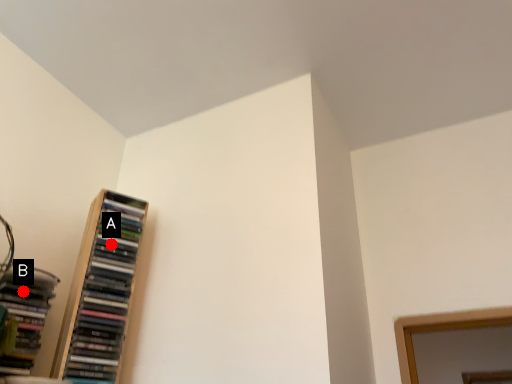
Question: Two points are circled on the image, labeled by A and B beside each circle. Among these points, which one is nearest to the camera?

Choices:
 (A) A is closer
 (B) B is closer

Answer: (B)